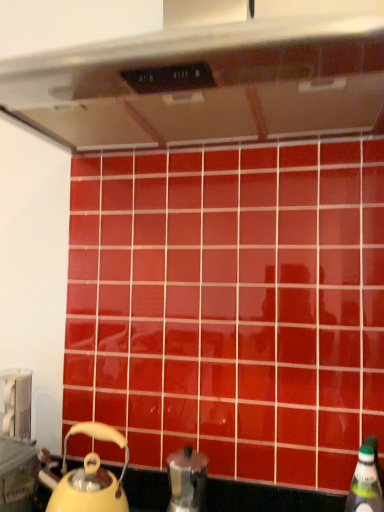
Question: Does point click(8, 411) appear closer or farther from the camera than point click(203, 509)?

Choices:
 (A) farther
 (B) closer

Answer: (A)

Question: From a real-world perspective, relative to metallic silver coffee pot at lower center, is metallic silver toaster at lower left vertically above or below?

Choices:
 (A) above
 (B) below

Answer: (A)

Question: Which object is the farthest from the green plastic bottle at lower right?

Choices:
 (A) satin silver exhaust hood at upper center
 (B) metallic silver toaster at lower left
 (C) metallic silver coffee pot at lower center
 (D) yellow matte kettle at lower left

Answer: (A)

Question: Estimate the real-world distances between objects in this image. Which object is closer to the metallic silver coffee pot at lower center?

Choices:
 (A) yellow matte kettle at lower left
 (B) metallic silver toaster at lower left
 (C) green plastic bottle at lower right
 (D) satin silver exhaust hood at upper center

Answer: (A)